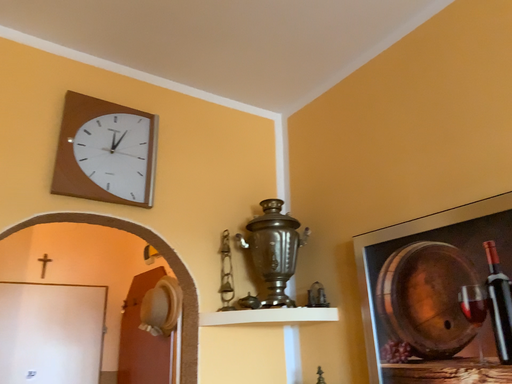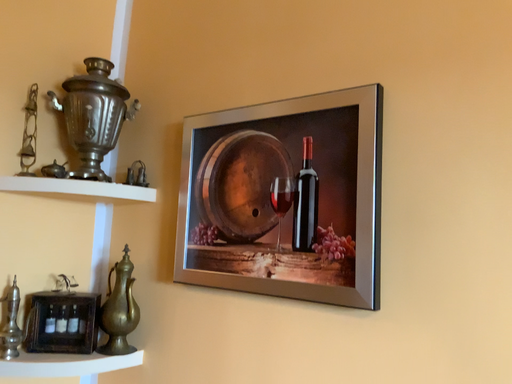
Question: How did the camera likely rotate when shooting the video?

Choices:
 (A) rotated left
 (B) rotated right

Answer: (B)